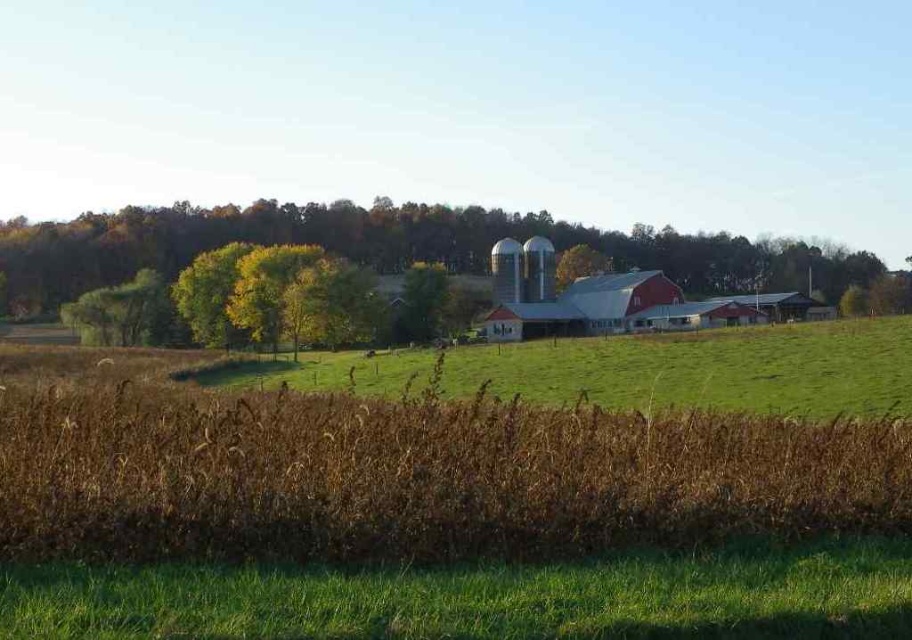
You are standing in the rural landscape and want to walk to the green leafy tree at center. Which direction should you go from the green grassy field at center to reach it?

The green grassy field at center is closer to the viewer than the green leafy tree at center, so you should move backward away from the green grassy field at center to reach the green leafy tree at center.

Looking at this image, you are standing in the middle of the field of dry stalks and want to walk towards the farm buildings in the midground. There are two points marked on your map as point 1 at coordinates point (x=623, y=241) and point 2 at coordinates point (x=473, y=371). Which point should you head towards to reach the farm buildings first?

You should head towards point 1 at coordinates point (x=623, y=241) first because it is closer to you than point 2 at coordinates point (x=473, y=371). Since point 1 is further to the camera, it is nearer to your current position in the foreground.

You are standing in the middle of the pasture and see the green leafy tree at upper center and the green leafy tree at center. Which tree is closer to you?

The green leafy tree at upper center is closer to you because it is in front of the green leafy tree at center.